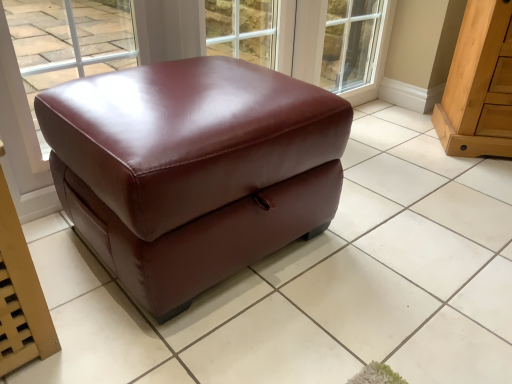
Question: Does satin brown leather ottoman at center, the 1th furniture from the left, have a greater width compared to light brown wood drawer at right, which appears as the second furniture when viewed from the left?

Choices:
 (A) yes
 (B) no

Answer: (A)

Question: Is satin brown leather ottoman at center, the 2th furniture in the right-to-left sequence, surrounding light brown wood drawer at right, placed as the 1th furniture when sorted from right to left?

Choices:
 (A) no
 (B) yes

Answer: (A)

Question: From a real-world perspective, is satin brown leather ottoman at center, the 2th furniture in the right-to-left sequence, positioned over light brown wood drawer at right, placed as the 1th furniture when sorted from right to left, based on gravity?

Choices:
 (A) no
 (B) yes

Answer: (A)

Question: From the image's perspective, is satin brown leather ottoman at center, the 2th furniture in the right-to-left sequence, on light brown wood drawer at right, which appears as the second furniture when viewed from the left?

Choices:
 (A) no
 (B) yes

Answer: (A)

Question: Does satin brown leather ottoman at center, the 2th furniture in the right-to-left sequence, turn towards light brown wood drawer at right, placed as the 1th furniture when sorted from right to left?

Choices:
 (A) no
 (B) yes

Answer: (A)

Question: From a real-world perspective, is satin brown leather ottoman at center, the 2th furniture in the right-to-left sequence, physically below light brown wood drawer at right, which appears as the second furniture when viewed from the left?

Choices:
 (A) yes
 (B) no

Answer: (A)

Question: Is transparent glass window at upper center outside of light brown wood drawer at right, placed as the 1th furniture when sorted from right to left?

Choices:
 (A) yes
 (B) no

Answer: (A)

Question: Is transparent glass window at upper center bigger than light brown wood drawer at right, placed as the 1th furniture when sorted from right to left?

Choices:
 (A) yes
 (B) no

Answer: (B)

Question: Considering the relative sizes of transparent glass window at upper center and light brown wood drawer at right, placed as the 1th furniture when sorted from right to left, in the image provided, is transparent glass window at upper center taller than light brown wood drawer at right, placed as the 1th furniture when sorted from right to left,?

Choices:
 (A) yes
 (B) no

Answer: (A)

Question: Is transparent glass window at upper center smaller than light brown wood drawer at right, placed as the 1th furniture when sorted from right to left?

Choices:
 (A) yes
 (B) no

Answer: (A)

Question: Does transparent glass window at upper center have a lesser width compared to light brown wood drawer at right, which appears as the second furniture when viewed from the left?

Choices:
 (A) yes
 (B) no

Answer: (A)

Question: Is transparent glass window at upper center with light brown wood drawer at right, placed as the 1th furniture when sorted from right to left?

Choices:
 (A) yes
 (B) no

Answer: (B)

Question: Is light brown wood drawer at right, placed as the 1th furniture when sorted from right to left, in contact with satin brown leather ottoman at center, the 1th furniture from the left?

Choices:
 (A) no
 (B) yes

Answer: (A)